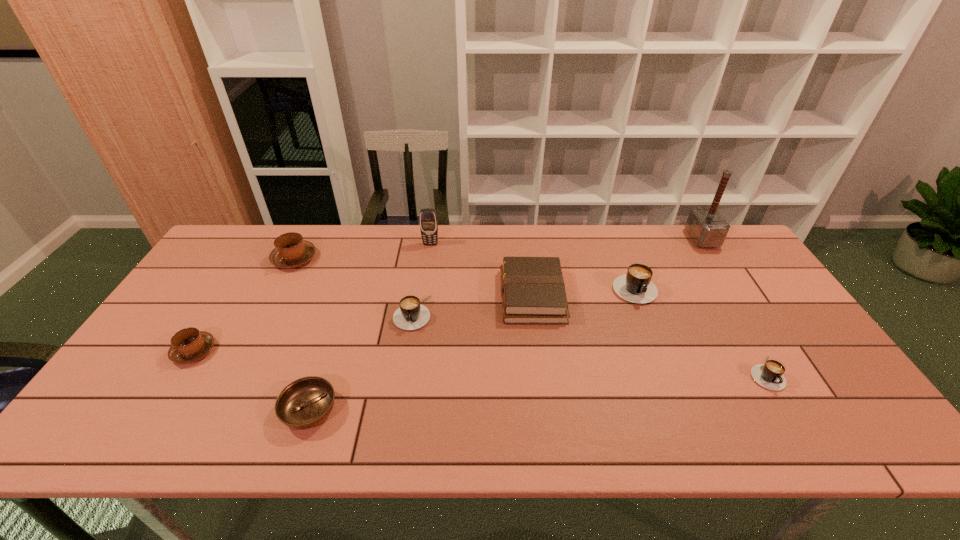
Where is `hammer at the right edge`? The width and height of the screenshot is (960, 540). hammer at the right edge is located at coordinates (705, 224).

The width and height of the screenshot is (960, 540). In order to click on cappuccino that is positioned at the right edge in this screenshot , I will do `click(769, 375)`.

Where is `object that is positioned at the far right corner`? The width and height of the screenshot is (960, 540). object that is positioned at the far right corner is located at coordinates (705, 224).

Locate an element on the screen. The width and height of the screenshot is (960, 540). free space at the far edge of the desktop is located at coordinates (412, 243).

Where is `free space at the near edge`? free space at the near edge is located at coordinates (565, 428).

Locate an element on the screen. vacant area at the left edge is located at coordinates (223, 280).

This screenshot has width=960, height=540. In order to click on free space at the right edge of the desktop in this screenshot , I will do `click(801, 372)`.

Locate an element on the screen. The image size is (960, 540). vacant region at the far left corner of the desktop is located at coordinates (240, 251).

Find the location of a particular element. The image size is (960, 540). free area in between the second smallest black cappuccino and the cellular telephone is located at coordinates (421, 278).

This screenshot has width=960, height=540. Find the location of `free point between the cellular telephone and the brown hammer`. free point between the cellular telephone and the brown hammer is located at coordinates (566, 241).